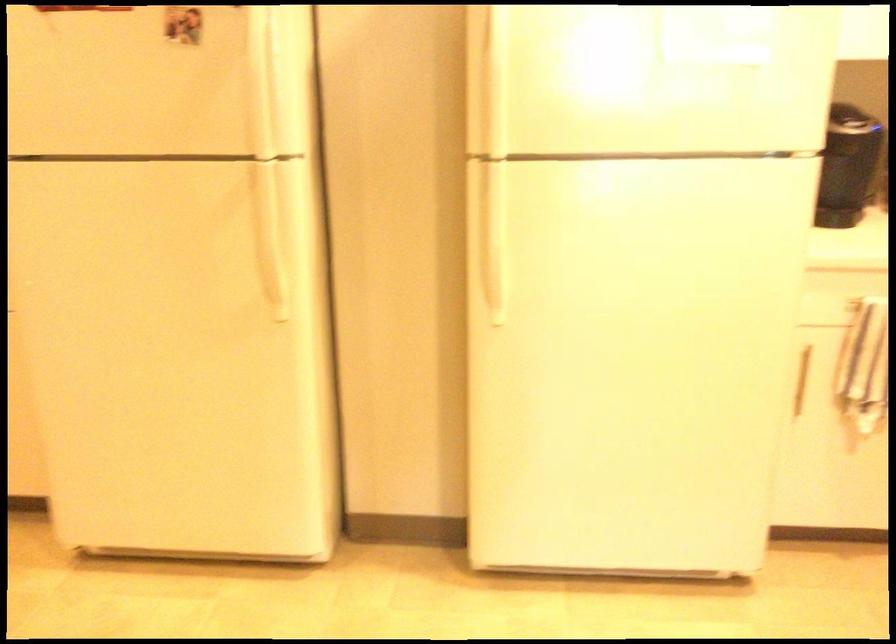
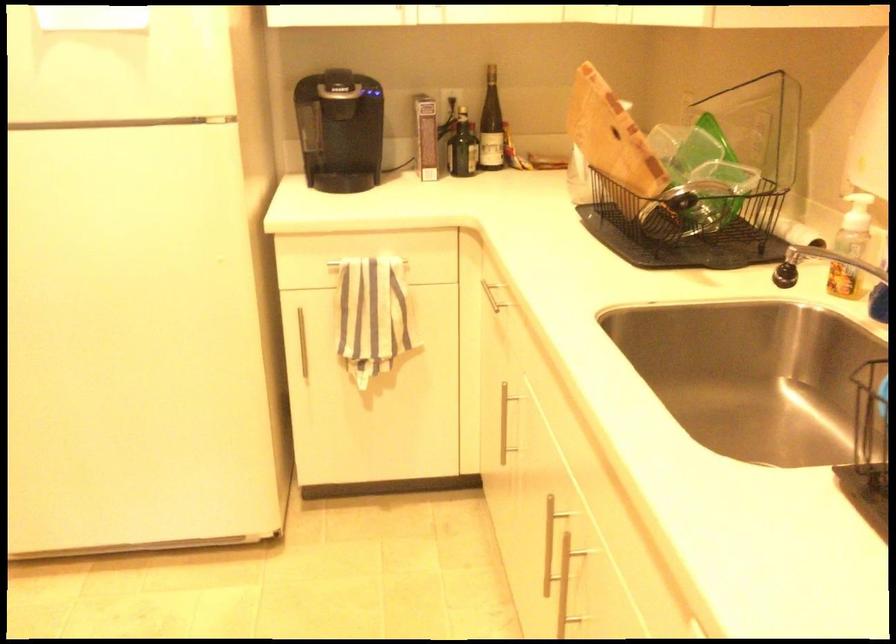
Question: In a continuous first-person perspective shot, in which direction is the camera moving?

Choices:
 (A) Left
 (B) Right
 (C) Forward
 (D) Backward

Answer: (B)